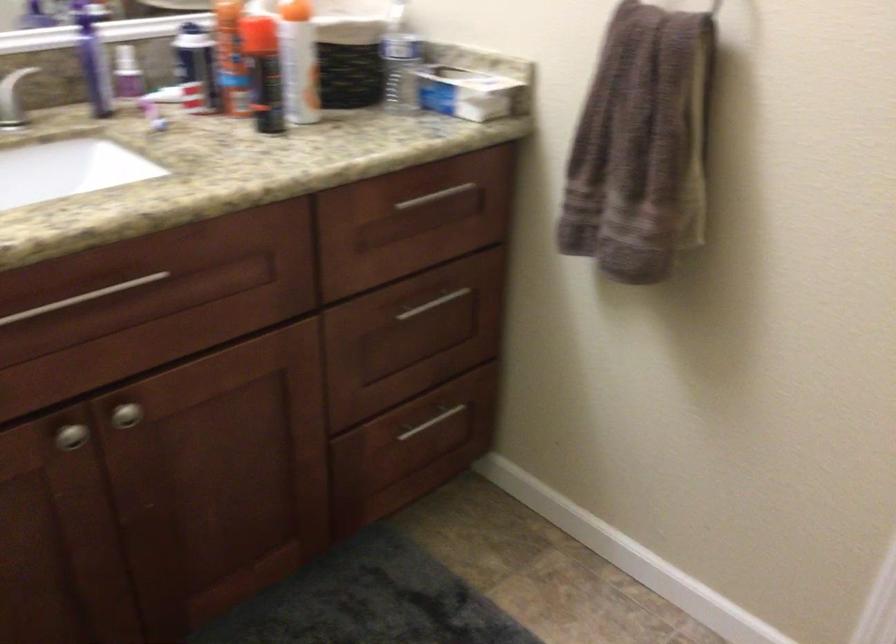
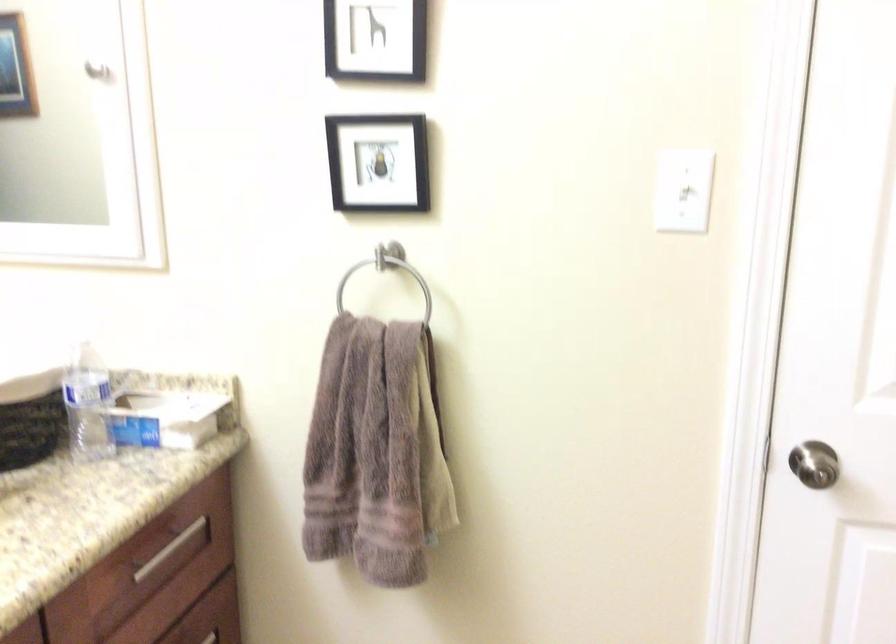
Find the pixel in the second image that matches point (431, 198) in the first image.

(168, 549)